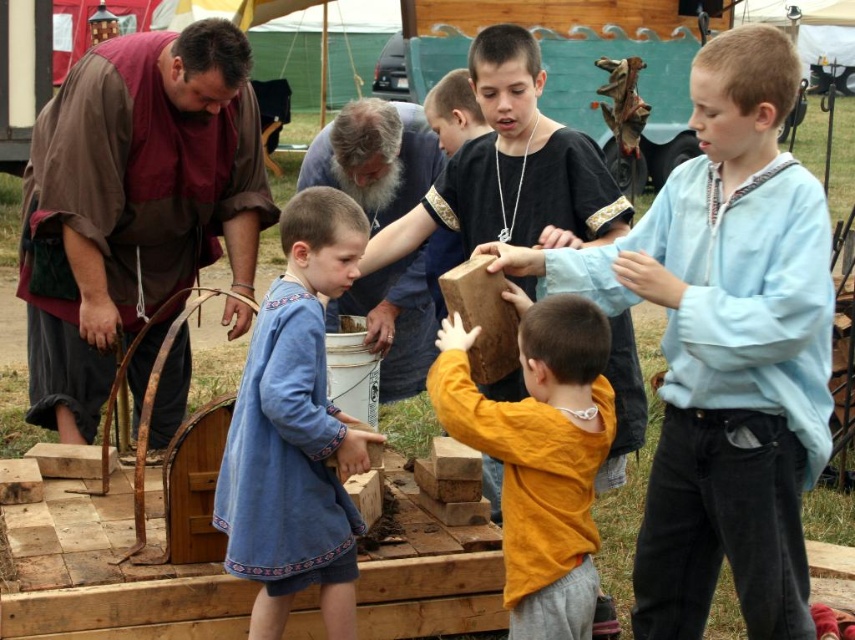
Is light blue cotton shirt at center shorter than wooden block at center?

In fact, light blue cotton shirt at center may be taller than wooden block at center.

Is light blue cotton shirt at center smaller than wooden block at center?

No.

Is point (730, 484) positioned in front of point (569, 179)?

Yes, it is.

At what (x,y) coordinates should I click in order to perform the action: click on light blue cotton shirt at center. Please return your answer as a coordinate pair (x, y). The height and width of the screenshot is (640, 855). Looking at the image, I should click on (724, 348).

Between brown leather vest at left and wooden block at center, which one has less height?

Standing shorter between the two is wooden block at center.

Who is positioned more to the left, brown leather vest at left or wooden block at center?

brown leather vest at left

Is point (96, 184) positioned before point (525, 189)?

That is False.

Find the location of `brown leather vest at left`. brown leather vest at left is located at coordinates (133, 204).

Consider the image. Does matte brown wooden block at center have a greater height compared to wooden block at center?

Correct, matte brown wooden block at center is much taller as wooden block at center.

Can you confirm if matte brown wooden block at center is positioned to the left of wooden block at center?

No, matte brown wooden block at center is not to the left of wooden block at center.

Where is `matte brown wooden block at center`? matte brown wooden block at center is located at coordinates (540, 454).

Where is `matte brown wooden block at center`? Image resolution: width=855 pixels, height=640 pixels. matte brown wooden block at center is located at coordinates (540, 454).